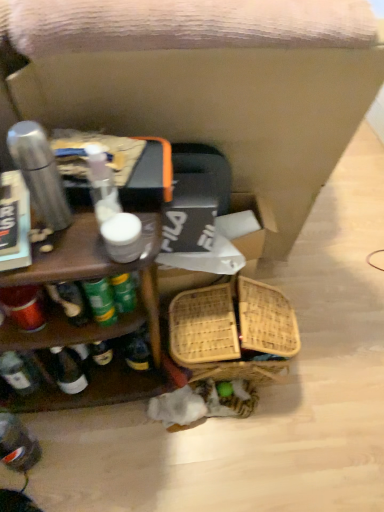
Question: Does wooden shelf at left lie in front of wooden swivel chair at center?

Choices:
 (A) yes
 (B) no

Answer: (B)

Question: Does wooden shelf at left have a larger size compared to wooden swivel chair at center?

Choices:
 (A) yes
 (B) no

Answer: (B)

Question: Is wooden shelf at left turned away from wooden swivel chair at center?

Choices:
 (A) no
 (B) yes

Answer: (B)

Question: Considering the relative sizes of wooden shelf at left and wooden swivel chair at center in the image provided, is wooden shelf at left shorter than wooden swivel chair at center?

Choices:
 (A) yes
 (B) no

Answer: (A)

Question: Is wooden shelf at left smaller than wooden swivel chair at center?

Choices:
 (A) yes
 (B) no

Answer: (A)

Question: Visually, is wooden shelf at left positioned to the left or to the right of translucent plastic bottle at lower left?

Choices:
 (A) left
 (B) right

Answer: (B)

Question: Looking at the image, does wooden shelf at left seem bigger or smaller compared to translucent plastic bottle at lower left?

Choices:
 (A) big
 (B) small

Answer: (A)

Question: Considering the positions of wooden shelf at left and translucent plastic bottle at lower left in the image, is wooden shelf at left wider or thinner than translucent plastic bottle at lower left?

Choices:
 (A) thin
 (B) wide

Answer: (B)

Question: From their relative heights in the image, would you say wooden shelf at left is taller or shorter than translucent plastic bottle at lower left?

Choices:
 (A) tall
 (B) short

Answer: (A)

Question: Is translucent plastic bottle at lower left inside the boundaries of wooden shelf at left, or outside?

Choices:
 (A) inside
 (B) outside

Answer: (B)

Question: Is translucent plastic bottle at lower left in front of or behind wooden shelf at left in the image?

Choices:
 (A) behind
 (B) front

Answer: (A)

Question: Is point (26, 444) closer or farther from the camera than point (122, 330)?

Choices:
 (A) farther
 (B) closer

Answer: (A)

Question: In terms of height, does translucent plastic bottle at lower left look taller or shorter compared to wooden shelf at left?

Choices:
 (A) tall
 (B) short

Answer: (B)

Question: From a real-world perspective, is woven bamboo basket at lower center positioned above or below woven cardboard box at center?

Choices:
 (A) above
 (B) below

Answer: (B)

Question: Is woven bamboo basket at lower center bigger or smaller than woven cardboard box at center?

Choices:
 (A) small
 (B) big

Answer: (A)